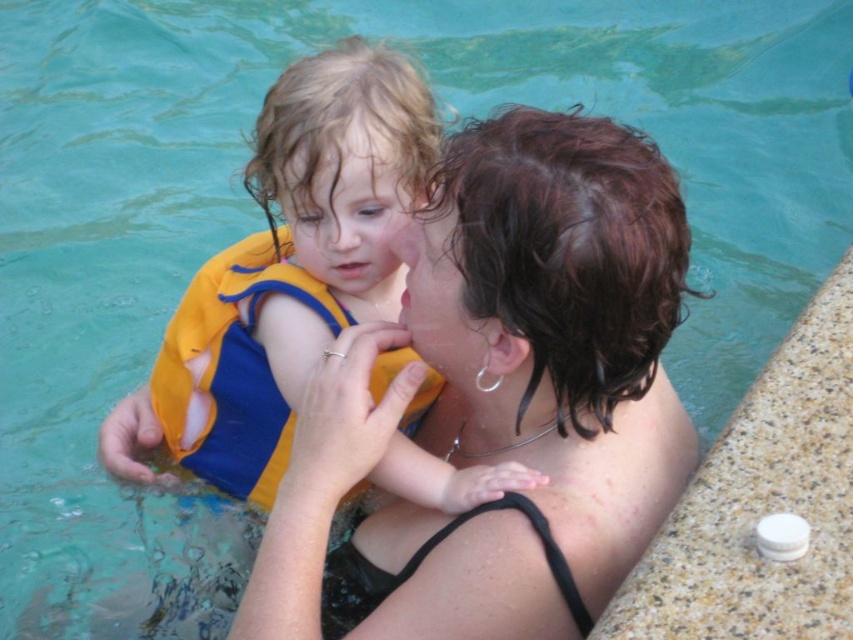
Is point (364, 218) positioned after point (190, 392)?

That is False.

Is yellow life vest at left thinner than yellow fabric life jacket at center?

No.

Which is in front, point (537, 481) or point (172, 403)?

Point (537, 481) is more forward.

Locate an element on the screen. yellow life vest at left is located at coordinates (294, 262).

Between matte yellow life vest at left and yellow fabric life jacket at center, which one is positioned higher?

Positioned higher is yellow fabric life jacket at center.

Is matte yellow life vest at left positioned in front of yellow fabric life jacket at center?

Yes, matte yellow life vest at left is in front of yellow fabric life jacket at center.

Which is behind, point (556, 412) or point (265, 230)?

Point (265, 230)

Where is `matte yellow life vest at left`? This screenshot has height=640, width=853. matte yellow life vest at left is located at coordinates (503, 397).

Who is more forward, (418, 230) or (374, 276)?

Point (418, 230) is more forward.

Measure the distance between matte yellow life vest at left and camera.

They are 2.13 meters apart.

Find the location of `matte yellow life vest at left`. matte yellow life vest at left is located at coordinates (503, 397).